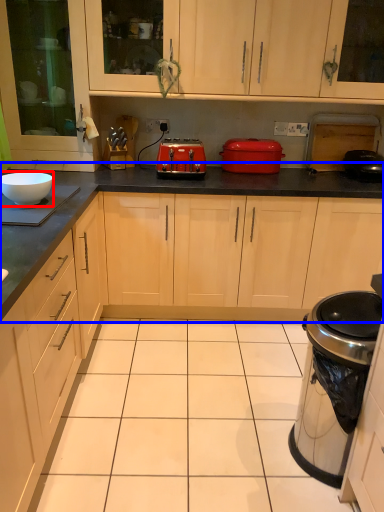
Question: Among these objects, which one is farthest to the camera, bowl (highlighted by a red box) or countertop (highlighted by a blue box)?

Choices:
 (A) bowl
 (B) countertop

Answer: (B)